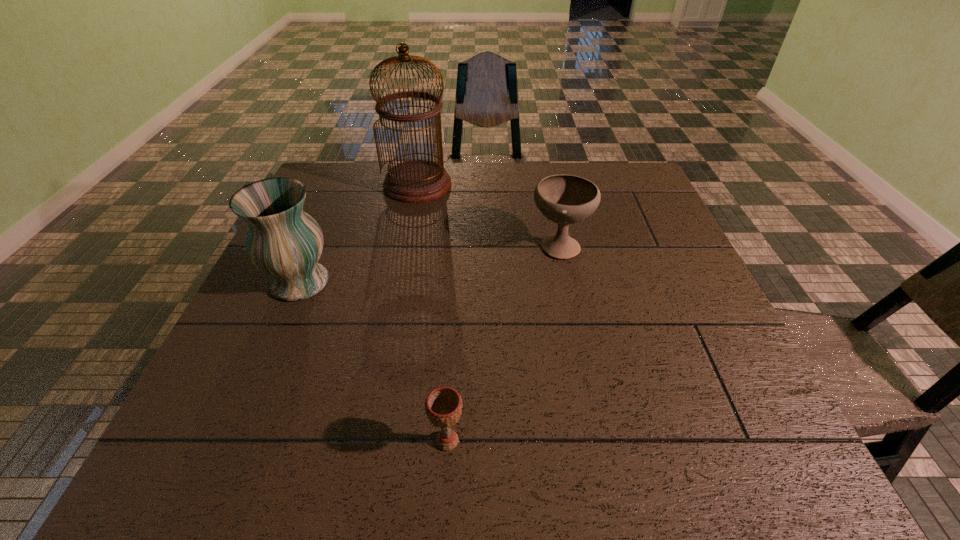
The height and width of the screenshot is (540, 960). I want to click on the third object from right to left, so click(415, 181).

This screenshot has width=960, height=540. In order to click on the farthest object in this screenshot , I will do `click(415, 181)`.

Find the location of a particular element. the second tallest object is located at coordinates [x=283, y=241].

The height and width of the screenshot is (540, 960). What are the coordinates of `the leftmost object` in the screenshot? It's located at (283, 241).

Locate an element on the screen. the farther chalice is located at coordinates (564, 199).

Where is `the second shortest object`? Image resolution: width=960 pixels, height=540 pixels. the second shortest object is located at coordinates (564, 199).

Locate an element on the screen. Image resolution: width=960 pixels, height=540 pixels. the nearer chalice is located at coordinates (443, 406).

Where is `the left chalice`? This screenshot has width=960, height=540. the left chalice is located at coordinates (443, 406).

The width and height of the screenshot is (960, 540). Identify the location of vacant space located on the front-facing side of the birdcage. (411, 219).

Where is `free region located on the front of the second tallest object`? The width and height of the screenshot is (960, 540). free region located on the front of the second tallest object is located at coordinates (247, 407).